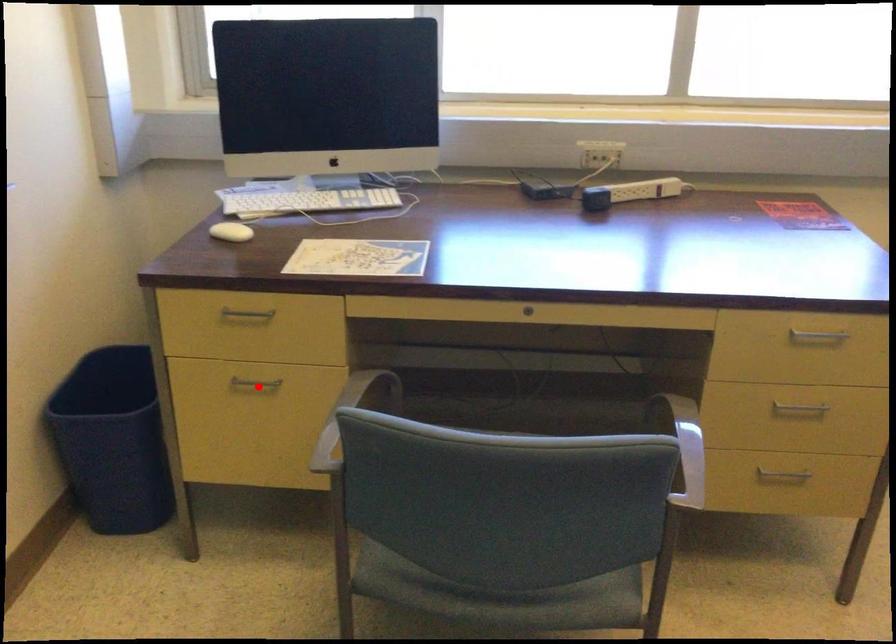
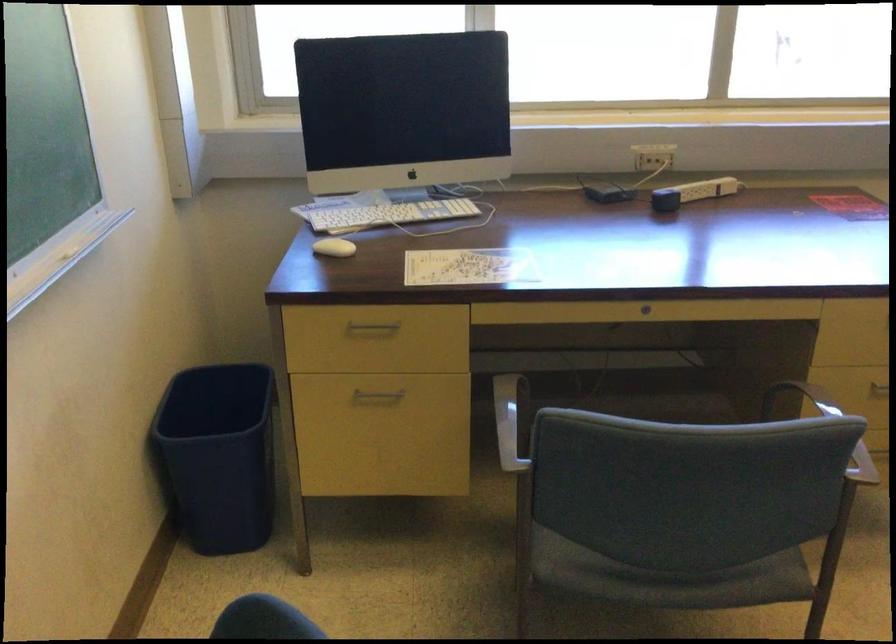
Locate, in the second image, the point that corresponds to the highlighted location in the first image.

(376, 395)